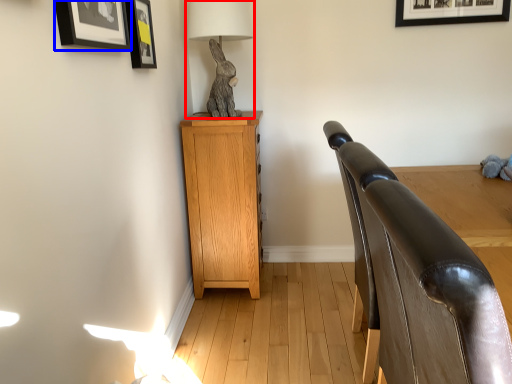
Question: Among these objects, which one is farthest to the camera, table lamp (highlighted by a red box) or picture frame (highlighted by a blue box)?

Choices:
 (A) table lamp
 (B) picture frame

Answer: (A)